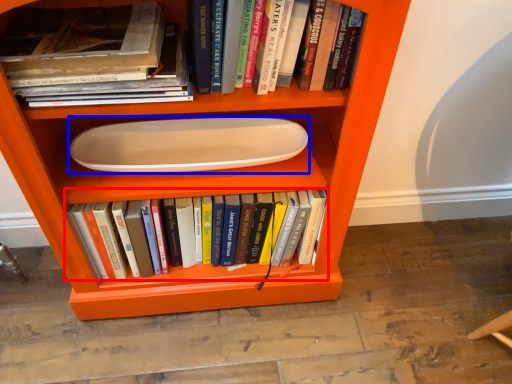
Question: Among these objects, which one is farthest to the camera, book (highlighted by a red box) or paper plate (highlighted by a blue box)?

Choices:
 (A) book
 (B) paper plate

Answer: (A)